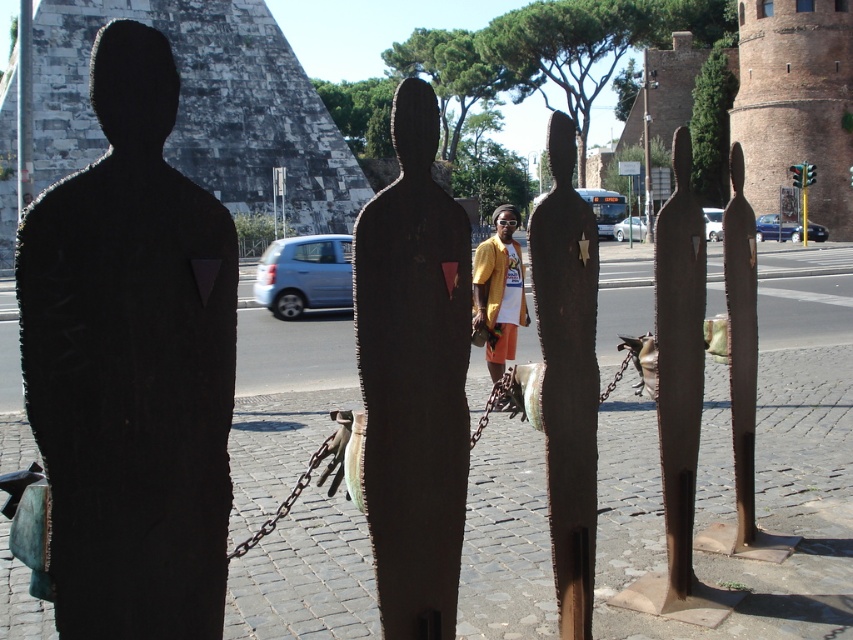
Who is more distant from viewer, (100,68) or (653,346)?

The point (653,346) is more distant.

Which is behind, point (103, 636) or point (657, 268)?

The point (657, 268) is more distant.

Where is `black matte statue at left`? The image size is (853, 640). black matte statue at left is located at coordinates (131, 364).

Between dark gray stone pyramid at upper left and rusty metal figure at center, which one is positioned lower?

rusty metal figure at center

Between dark gray stone pyramid at upper left and rusty metal figure at center, which one has less height?

With less height is rusty metal figure at center.

Who is more forward, (234, 205) or (585, 362)?

Point (585, 362) is more forward.

Identify the location of dark gray stone pyramid at upper left. (202, 106).

Looking at this image, which is below, rustic wood figure at center or dark gray stone pyramid at upper left?

rustic wood figure at center

Is rustic wood figure at center smaller than dark gray stone pyramid at upper left?

Correct, rustic wood figure at center occupies less space than dark gray stone pyramid at upper left.

Who is more distant from viewer, (425, 90) or (231, 81)?

The point (231, 81) is behind.

The height and width of the screenshot is (640, 853). In order to click on rustic wood figure at center in this screenshot , I will do `click(415, 378)`.